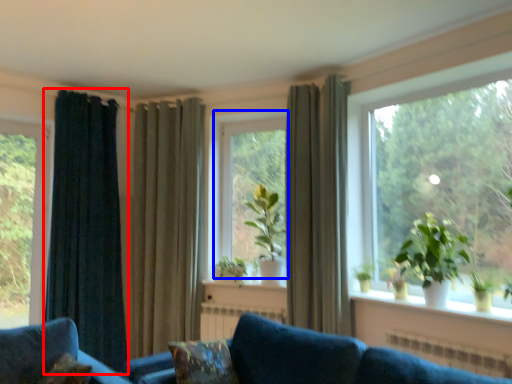
Question: Which point is closer to the camera, curtain (highlighted by a red box) or bay window (highlighted by a blue box)?

Choices:
 (A) curtain
 (B) bay window

Answer: (A)